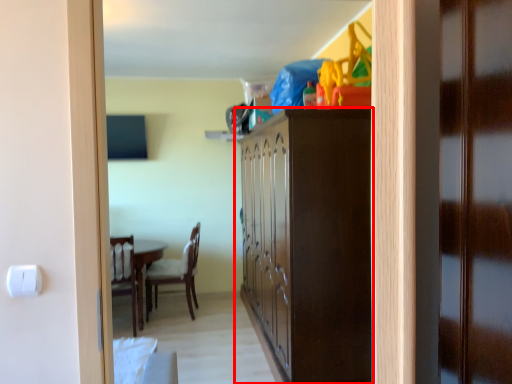
Question: From the image's perspective, considering the relative positions of cabinetry (annotated by the red box) and door in the image provided, where is cabinetry (annotated by the red box) located with respect to the staircase?

Choices:
 (A) above
 (B) below

Answer: (B)